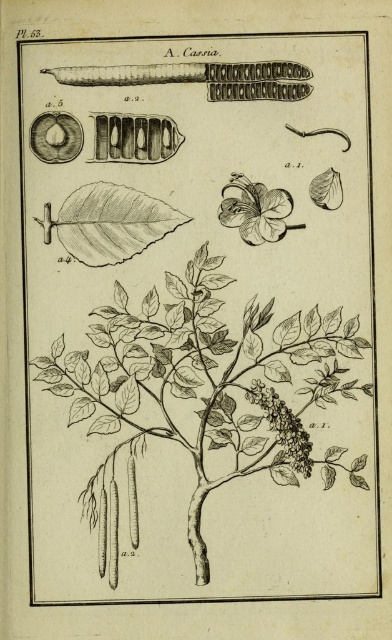
You are examining the botanical illustration of the Cassia plant. You notice two points marked at coordinates point (x=281, y=404) and point (x=266, y=198). From your perspective looking at the illustration, which point appears closer to you?

Point (x=281, y=404) is in front of point (x=266, y=198), so it appears closer to you.

You are examining the botanical illustration of the cassia tree. Where is the black ink tree at center positioned in the image?

The black ink tree at center is positioned at coordinates point (203, 394).